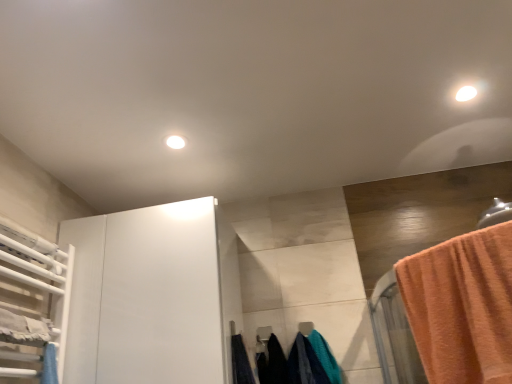
Describe the element at coordinates (162, 296) in the screenshot. I see `white matte cabinet at left` at that location.

Where is `white matte cabinet at left`? This screenshot has width=512, height=384. white matte cabinet at left is located at coordinates (162, 296).

This screenshot has height=384, width=512. I want to click on white matte cabinet at left, so click(162, 296).